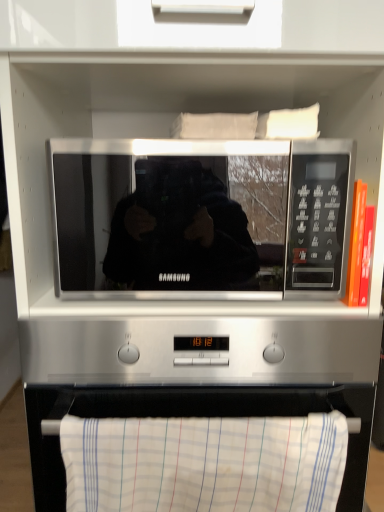
Question: Choose the correct answer: Is white striped towel at lower center inside black glossy microwave at center or outside it?

Choices:
 (A) outside
 (B) inside

Answer: (A)

Question: Is white striped towel at lower center taller or shorter than black glossy microwave at center?

Choices:
 (A) tall
 (B) short

Answer: (B)

Question: From the image's perspective, is white striped towel at lower center above or below black glossy microwave at center?

Choices:
 (A) below
 (B) above

Answer: (A)

Question: From a real-world perspective, is black glossy microwave at center above or below white striped towel at lower center?

Choices:
 (A) below
 (B) above

Answer: (B)

Question: Which is correct: black glossy microwave at center is inside white striped towel at lower center, or outside of it?

Choices:
 (A) outside
 (B) inside

Answer: (A)

Question: Considering their positions, is black glossy microwave at center located in front of or behind white striped towel at lower center?

Choices:
 (A) front
 (B) behind

Answer: (B)

Question: From the image's perspective, is black glossy microwave at center above or below white striped towel at lower center?

Choices:
 (A) above
 (B) below

Answer: (A)